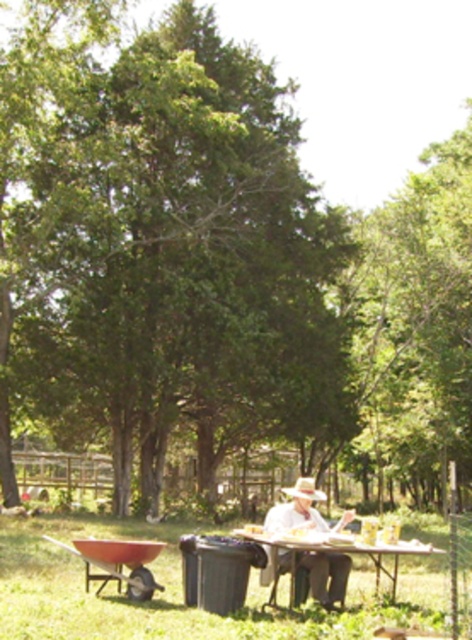
You are standing at the origin point in the image. Where is the white plastic table at center located in terms of coordinates?

The white plastic table at center is located at coordinates point (331, 552).

You are standing in the backyard and see the green leafy tree at center. There is a point marked at coordinates (x=170, y=253) in the image. Is this point located on the green leafy tree at center?

Yes, the point at (x=170, y=253) is located on the green leafy tree at center as stated in the description.

You are standing in the garden scene and want to know how far the point at coordinates (x=276, y=228) is from your current position. Can you determine the distance?

The point at coordinates (x=276, y=228) is 32.89 meters away from your current position.